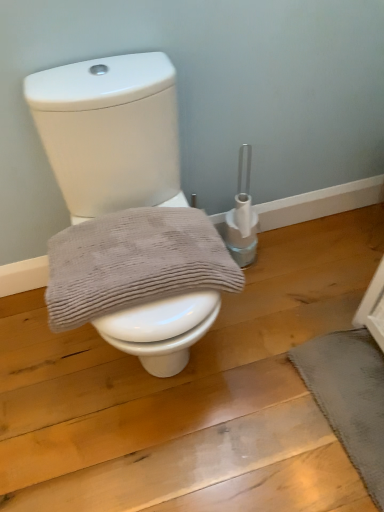
The image size is (384, 512). Describe the element at coordinates (110, 132) in the screenshot. I see `white glossy toilet at center` at that location.

This screenshot has height=512, width=384. What do you see at coordinates (134, 263) in the screenshot?
I see `gray textured towel at center` at bounding box center [134, 263].

The width and height of the screenshot is (384, 512). I want to click on white glossy toilet at center, so click(x=110, y=132).

The width and height of the screenshot is (384, 512). In order to click on bath towel lying in front of the dark gray textured bath mat at lower right in this screenshot , I will do `click(134, 263)`.

Which object is positioned more to the left, gray textured towel at center or dark gray textured bath mat at lower right?

gray textured towel at center.

Does gray textured towel at center have a lesser width compared to dark gray textured bath mat at lower right?

In fact, gray textured towel at center might be wider than dark gray textured bath mat at lower right.

From the image's perspective, is gray textured towel at center positioned above or below dark gray textured bath mat at lower right?

Based on their image positions, gray textured towel at center is located above dark gray textured bath mat at lower right.

Is gray textured towel at center turned away from white glossy toilet at center?

Absolutely, gray textured towel at center is directed away from white glossy toilet at center.

From a real-world perspective, is gray textured towel at center physically below white glossy toilet at center?

No, from a real-world perspective, gray textured towel at center is not under white glossy toilet at center.

Where is `toilet to the right of gray textured towel at center`? This screenshot has width=384, height=512. toilet to the right of gray textured towel at center is located at coordinates (110, 132).

Considering the relative positions of gray textured towel at center and white glossy toilet at center in the image provided, is gray textured towel at center to the right of white glossy toilet at center from the viewer's perspective?

Incorrect, gray textured towel at center is not on the right side of white glossy toilet at center.

Does white glossy toilet at center have a greater width compared to dark gray textured bath mat at lower right?

Correct, the width of white glossy toilet at center exceeds that of dark gray textured bath mat at lower right.

Is white glossy toilet at center not inside dark gray textured bath mat at lower right?

Indeed, white glossy toilet at center is completely outside dark gray textured bath mat at lower right.

Is the position of white glossy toilet at center more distant than that of dark gray textured bath mat at lower right?

No, white glossy toilet at center is closer to the viewer.

Find the location of a particular element. The height and width of the screenshot is (512, 384). toilet located in front of the gray textured towel at center is located at coordinates (110, 132).

Considering the sizes of objects white glossy toilet at center and gray textured towel at center in the image provided, who is taller, white glossy toilet at center or gray textured towel at center?

With more height is white glossy toilet at center.

How far apart are white glossy toilet at center and gray textured towel at center?

white glossy toilet at center is 9.47 inches away from gray textured towel at center.

Is white glossy toilet at center at the left side of gray textured towel at center?

In fact, white glossy toilet at center is to the right of gray textured towel at center.

Between dark gray textured bath mat at lower right and gray textured towel at center, which one has less height?

Standing shorter between the two is dark gray textured bath mat at lower right.

From the picture: Is dark gray textured bath mat at lower right aimed at gray textured towel at center?

No, dark gray textured bath mat at lower right is not aimed at gray textured towel at center.

From the image's perspective, between dark gray textured bath mat at lower right and gray textured towel at center, who is located below?

dark gray textured bath mat at lower right appears lower in the image.

Consider the image. Could you tell me if dark gray textured bath mat at lower right is facing white glossy toilet at center?

No, dark gray textured bath mat at lower right does not turn towards white glossy toilet at center.

Is dark gray textured bath mat at lower right at the right side of white glossy toilet at center?

Yes.

Is dark gray textured bath mat at lower right shorter than white glossy toilet at center?

Yes, dark gray textured bath mat at lower right is shorter than white glossy toilet at center.

Locate an element on the screen. bath mat on the right of white glossy toilet at center is located at coordinates (349, 397).

This screenshot has height=512, width=384. I want to click on bath mat below the gray textured towel at center (from a real-world perspective), so click(x=349, y=397).

The height and width of the screenshot is (512, 384). What are the coordinates of `bath towel that appears behind the white glossy toilet at center` in the screenshot? It's located at (134, 263).

When comparing their distances from gray textured towel at center, does dark gray textured bath mat at lower right or white glossy toilet at center seem closer?

white glossy toilet at center is positioned closer to the anchor gray textured towel at center.

Which object lies further to the anchor point dark gray textured bath mat at lower right, white glossy toilet at center or gray textured towel at center?

Based on the image, white glossy toilet at center appears to be further to dark gray textured bath mat at lower right.

From the picture: From the image, which object appears to be nearer to white glossy toilet at center, gray textured towel at center or dark gray textured bath mat at lower right?

gray textured towel at center lies closer to white glossy toilet at center than the other object.

Looking at this image, based on their spatial positions, is white glossy toilet at center or dark gray textured bath mat at lower right further from gray textured towel at center?

The object further to gray textured towel at center is dark gray textured bath mat at lower right.

When comparing their distances from white glossy toilet at center, does dark gray textured bath mat at lower right or gray textured towel at center seem further?

dark gray textured bath mat at lower right is further to white glossy toilet at center.

Estimate the real-world distances between objects in this image. Which object is further from dark gray textured bath mat at lower right, gray textured towel at center or white glossy toilet at center?

Based on the image, white glossy toilet at center appears to be further to dark gray textured bath mat at lower right.

Where is `toilet between gray textured towel at center and dark gray textured bath mat at lower right`? The image size is (384, 512). toilet between gray textured towel at center and dark gray textured bath mat at lower right is located at coordinates point(110,132).